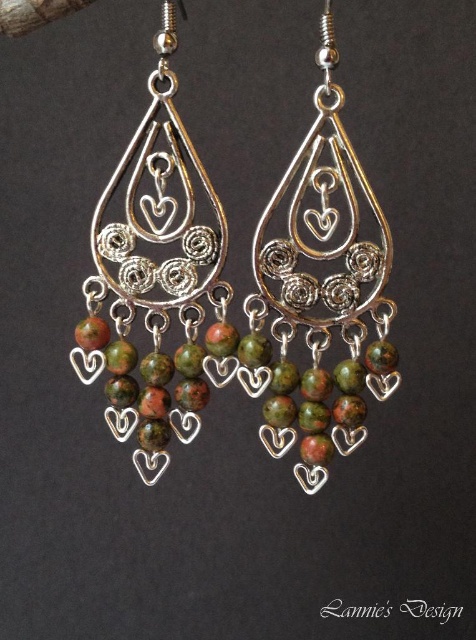
Is green marbled beads at center wider than green marble earrings at center?

No, green marbled beads at center is not wider than green marble earrings at center.

Does point (347, 452) come closer to viewer compared to point (126, 326)?

Yes, point (347, 452) is closer to viewer.

I want to click on green marbled beads at center, so click(x=324, y=289).